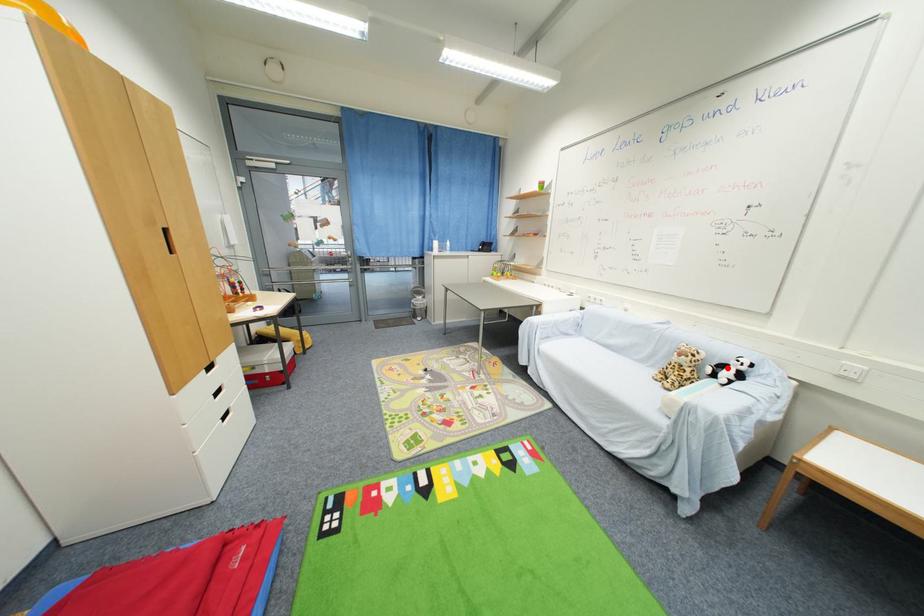
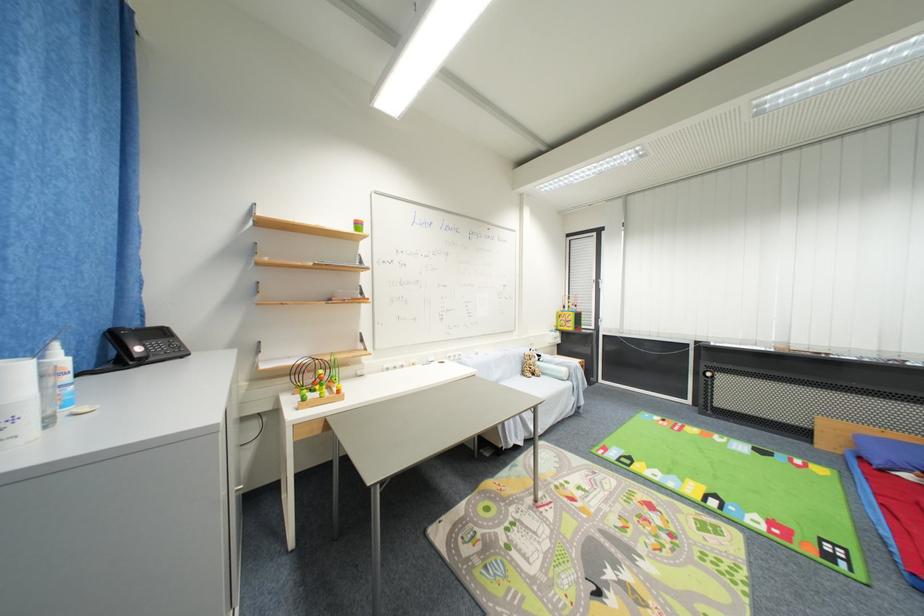
Question: I am providing you with two images of the same scene from different viewpoints. A red point is marked on the first image. Is the red point's position out of view in image 2?

Choices:
 (A) Yes
 (B) No

Answer: (A)